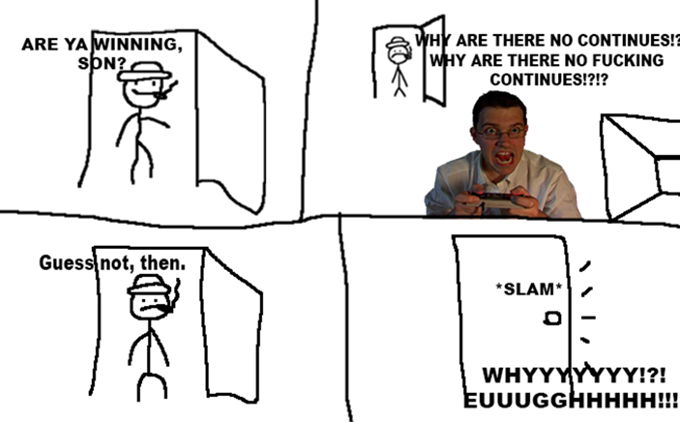
This screenshot has height=422, width=680. Identify the location of door knob. (553, 318).